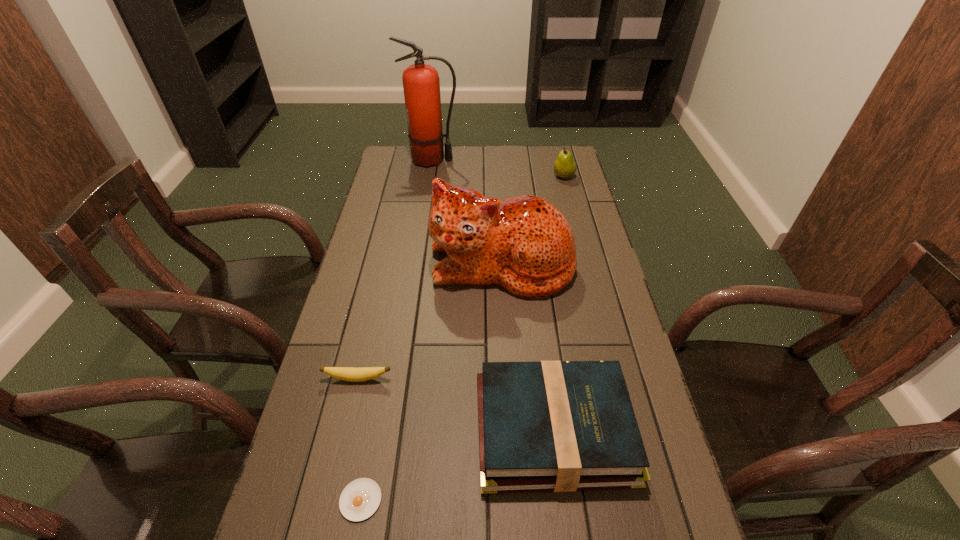
Find the location of a particular element. free location located on the face of the second tallest object is located at coordinates (509, 402).

Where is `vacant space situated on the left of the fifth nearest object`? This screenshot has height=540, width=960. vacant space situated on the left of the fifth nearest object is located at coordinates (539, 176).

Identify the location of free spot located on the back of the fourth tallest object. (539, 310).

The image size is (960, 540). I want to click on vacant area situated 0.290m on the right of the banana, so click(x=506, y=379).

This screenshot has width=960, height=540. I want to click on vacant space located 0.330m on the right of the shortest object, so click(540, 500).

The image size is (960, 540). I want to click on fire extinguisher located in the far edge section of the desktop, so click(x=421, y=84).

Locate an element on the screen. The height and width of the screenshot is (540, 960). pear that is at the far edge is located at coordinates (564, 167).

This screenshot has height=540, width=960. I want to click on fire extinguisher situated at the left edge, so click(x=421, y=84).

This screenshot has width=960, height=540. I want to click on banana that is at the left edge, so click(352, 374).

Where is `egg yolk that is at the left edge`? Image resolution: width=960 pixels, height=540 pixels. egg yolk that is at the left edge is located at coordinates (359, 500).